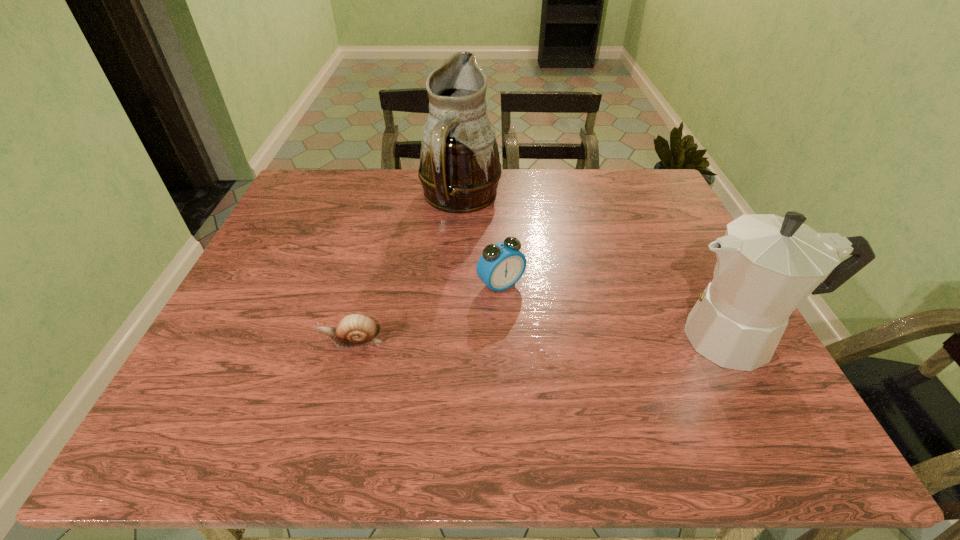
Find the location of a particular element. The image size is (960, 540). vacant area situated 0.160m on the front-facing side of the escargot is located at coordinates click(249, 341).

Locate an element on the screen. vacant space located 0.340m at the spout of the rightmost object is located at coordinates 516,338.

In order to click on vacant space located at the spout of the rightmost object in this screenshot , I will do `click(602, 338)`.

Locate an element on the screen. vacant space located at the spout of the rightmost object is located at coordinates (490, 338).

This screenshot has width=960, height=540. What are the coordinates of `free region located 0.110m from the spout of the farthest object` in the screenshot? It's located at (492, 251).

You are a GUI agent. You are given a task and a screenshot of the screen. Output one action in this format:
    pyautogui.click(x=<x>, y=<y>)
    Task: Click on the free space located 0.310m from the spout of the farthest object
    
    Given the screenshot: What is the action you would take?
    pyautogui.click(x=526, y=300)

At what (x,y) coordinates should I click in order to perform the action: click on vacant space situated from the spout of the farthest object. Please return your answer as a coordinate pair (x, y). Looking at the image, I should click on (488, 245).

I want to click on free space located 0.320m on the face of the second shortest object, so click(x=610, y=394).

Identify the location of free space located on the face of the second shortest object. This screenshot has width=960, height=540. (595, 380).

The height and width of the screenshot is (540, 960). Identify the location of free space located on the face of the second shortest object. (582, 366).